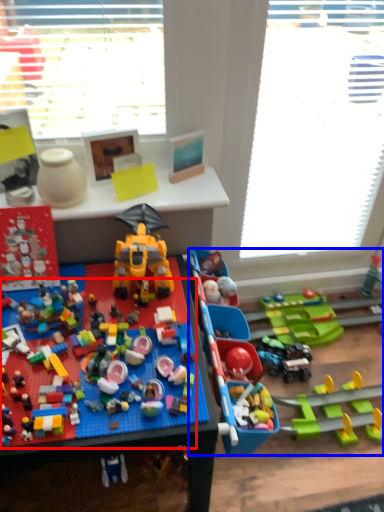
Question: Among these objects, which one is nearest to the camera, toy (highlighted by a red box) or toy (highlighted by a blue box)?

Choices:
 (A) toy
 (B) toy

Answer: (A)